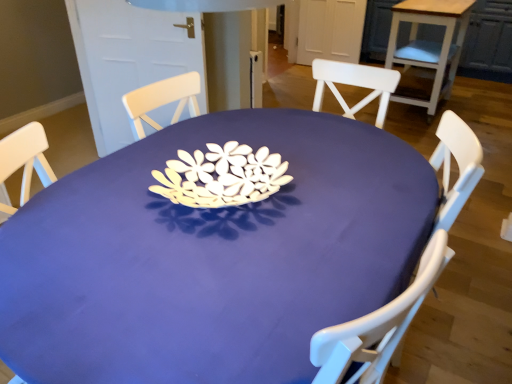
Question: Is matte purple table at center, acting as the 1th table starting from the left, further to camera compared to wooden table at upper right, arranged as the 2th table when viewed from the left?

Choices:
 (A) yes
 (B) no

Answer: (B)

Question: Considering the relative sizes of matte purple table at center, arranged as the 1th table when ordered from the bottom, and wooden table at upper right, placed as the 1th table when sorted from right to left, in the image provided, is matte purple table at center, arranged as the 1th table when ordered from the bottom, shorter than wooden table at upper right, placed as the 1th table when sorted from right to left,?

Choices:
 (A) yes
 (B) no

Answer: (A)

Question: Considering the relative sizes of matte purple table at center, the 2th table positioned from the back, and wooden table at upper right, arranged as the second table when viewed from the front, in the image provided, is matte purple table at center, the 2th table positioned from the back, thinner than wooden table at upper right, arranged as the second table when viewed from the front,?

Choices:
 (A) yes
 (B) no

Answer: (B)

Question: Is matte purple table at center, acting as the 1th table starting from the left, oriented away from wooden table at upper right, which appears as the first table when viewed from the top?

Choices:
 (A) no
 (B) yes

Answer: (A)

Question: From the image's perspective, would you say matte purple table at center, the 2th table positioned from the back, is shown under wooden table at upper right, which is the 2th table in bottom-to-top order?

Choices:
 (A) yes
 (B) no

Answer: (A)

Question: Considering the relative positions of matte purple table at center, the 1th table viewed from the front, and wooden table at upper right, which appears as the first table when viewed from the top, in the image provided, is matte purple table at center, the 1th table viewed from the front, to the left of wooden table at upper right, which appears as the first table when viewed from the top, from the viewer's perspective?

Choices:
 (A) yes
 (B) no

Answer: (A)

Question: Is wooden table at upper right, which is the 2th table in bottom-to-top order, positioned beyond the bounds of matte purple table at center, the 2th table positioned from the back?

Choices:
 (A) no
 (B) yes

Answer: (B)

Question: Does wooden table at upper right, which is the 2th table in bottom-to-top order, have a lesser height compared to matte purple table at center, the 2th table when ordered from right to left?

Choices:
 (A) no
 (B) yes

Answer: (A)

Question: Is matte purple table at center, which is the 2th table from top to bottom, a part of wooden table at upper right, which is counted as the first table, starting from the back?

Choices:
 (A) yes
 (B) no

Answer: (B)

Question: From a real-world perspective, is wooden table at upper right, which is the 2th table in bottom-to-top order, located beneath matte purple table at center, which is the 2th table from top to bottom?

Choices:
 (A) no
 (B) yes

Answer: (A)

Question: From a real-world perspective, is wooden table at upper right, arranged as the second table when viewed from the front, over matte purple table at center, the 1th table viewed from the front?

Choices:
 (A) yes
 (B) no

Answer: (A)

Question: Is wooden table at upper right, which is counted as the first table, starting from the back, oriented away from matte purple table at center, the 2th table positioned from the back?

Choices:
 (A) no
 (B) yes

Answer: (A)

Question: In terms of width, does matte purple table at center, the 2th table positioned from the back, look wider or thinner when compared to wooden table at upper right, arranged as the second table when viewed from the front?

Choices:
 (A) wide
 (B) thin

Answer: (A)